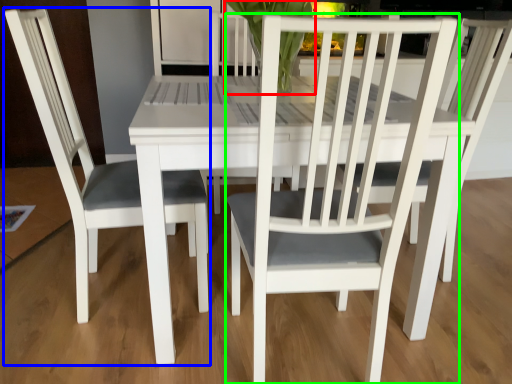
Question: Which is farther away from orchid (highlighted by a red box)? chair (highlighted by a blue box) or chair (highlighted by a green box)?

Choices:
 (A) chair
 (B) chair

Answer: (B)